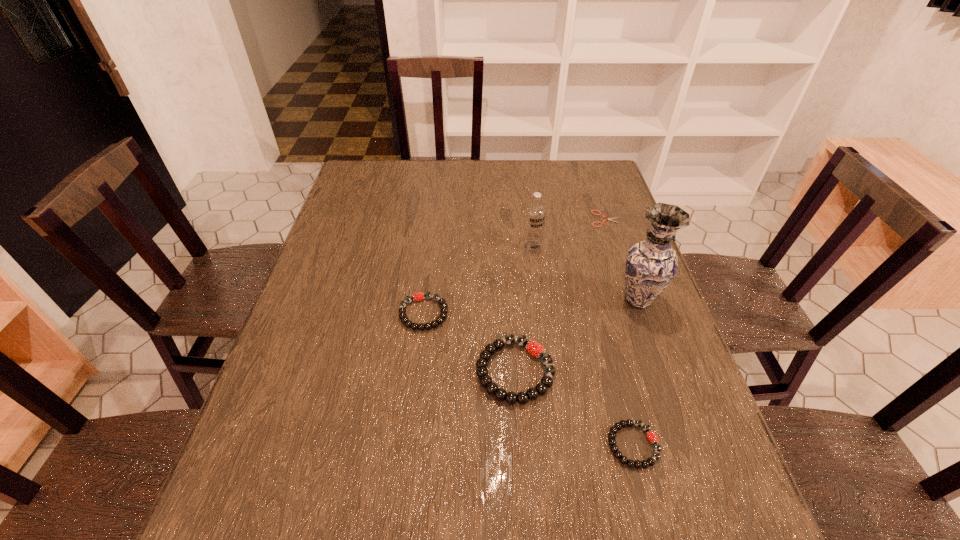
At what (x,y) coordinates should I click in order to perform the action: click on shears. Please return your answer as a coordinate pair (x, y). The height and width of the screenshot is (540, 960). Looking at the image, I should click on (609, 219).

What are the coordinates of `free spot located on the left of the leftmost bracelet` in the screenshot? It's located at (307, 314).

Where is `vacant space located 0.120m on the right of the second nearest object`? This screenshot has width=960, height=540. vacant space located 0.120m on the right of the second nearest object is located at coordinates (609, 371).

The image size is (960, 540). Identify the location of vacant point located 0.230m on the left of the shortest bracelet. (490, 445).

You are a GUI agent. You are given a task and a screenshot of the screen. Output one action in this format:
    pyautogui.click(x=<x>, y=<y>)
    Task: Click on the free point located on the back of the tallest object
    This screenshot has width=960, height=540.
    Given the screenshot: What is the action you would take?
    pyautogui.click(x=623, y=259)

Identify the location of free space located 0.380m on the front label of the second farthest object. (547, 362).

I want to click on vacant region located on the front of the shortest object, so click(624, 274).

Identify the location of object that is at the near edge. (652, 437).

Where is `bracelet that is positioned at the right edge`? The image size is (960, 540). bracelet that is positioned at the right edge is located at coordinates (652, 437).

You are a GUI agent. You are given a task and a screenshot of the screen. Output one action in this format:
    pyautogui.click(x=<x>, y=<y>)
    Task: Click on the vase present at the right edge
    
    Given the screenshot: What is the action you would take?
    pyautogui.click(x=651, y=264)